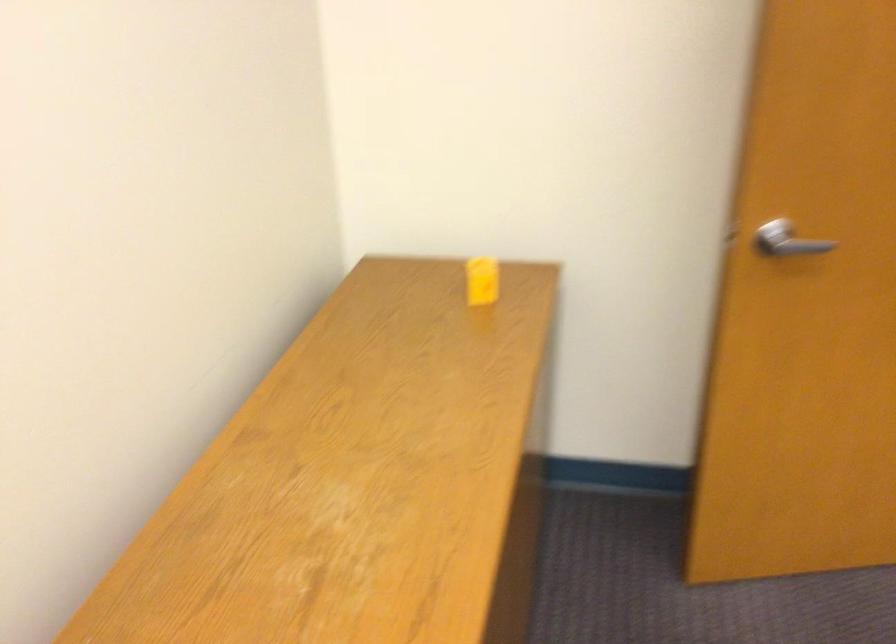
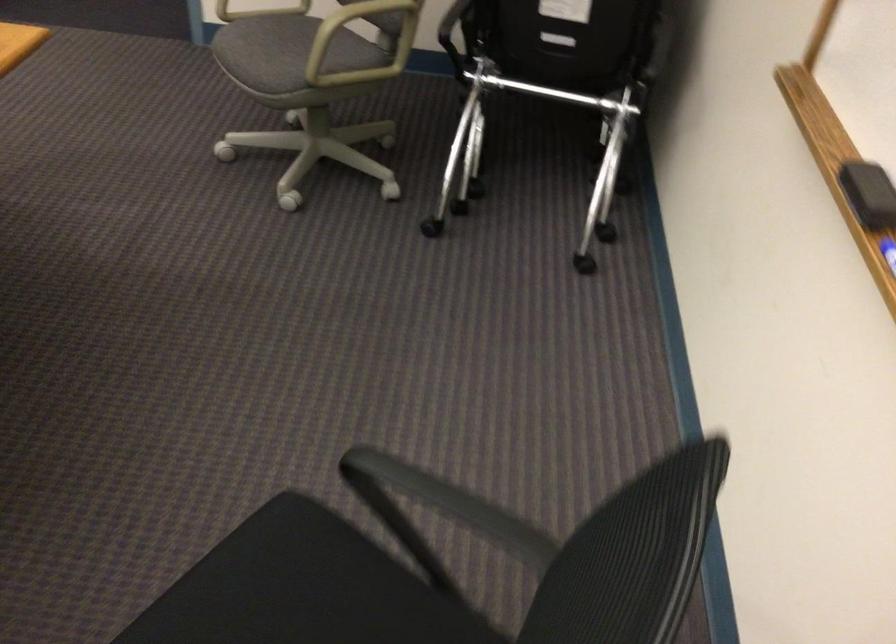
What movement of the cameraman would produce the second image?

The movement direction of the cameraman is right, backward.